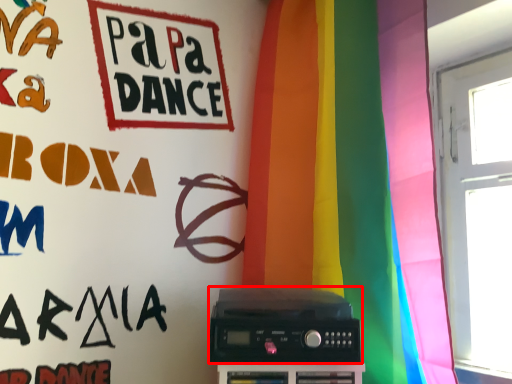
Question: From the image's perspective, considering the relative positions of amplifier (annotated by the red box) and curtain in the image provided, where is amplifier (annotated by the red box) located with respect to the staircase?

Choices:
 (A) below
 (B) above

Answer: (A)